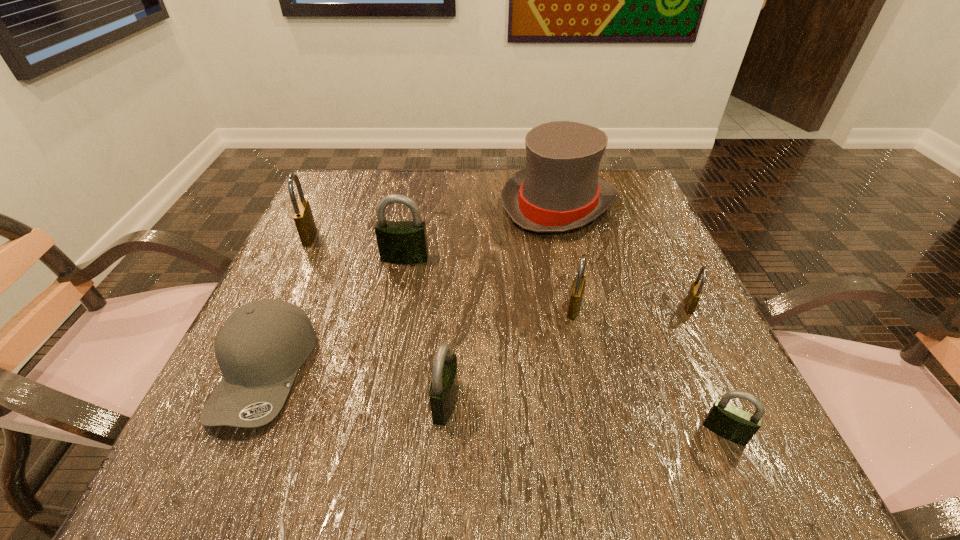
Image resolution: width=960 pixels, height=540 pixels. Identify the location of the smallest brass padlock. (695, 291).

The width and height of the screenshot is (960, 540). I want to click on the smallest black padlock, so click(732, 423).

The image size is (960, 540). What are the coordinates of `free location located on the front of the gray dress hat` in the screenshot? It's located at (593, 352).

Identify the location of vacant space located 0.240m on the front of the farthest brass padlock. This screenshot has height=540, width=960. (263, 333).

Locate an element on the screen. The width and height of the screenshot is (960, 540). free space located 0.130m on the left of the biggest black padlock is located at coordinates (318, 258).

The width and height of the screenshot is (960, 540). Identify the location of free space located 0.090m on the right of the third padlock from right to left. (633, 308).

Where is `free space located 0.340m on the back of the fourth object from left to right`? Image resolution: width=960 pixels, height=540 pixels. free space located 0.340m on the back of the fourth object from left to right is located at coordinates (456, 245).

What are the coordinates of `blank space located 0.160m on the back of the smallest brass padlock` in the screenshot? It's located at (660, 245).

This screenshot has width=960, height=540. Find the location of `vacant space located on the left of the smallest black padlock`. vacant space located on the left of the smallest black padlock is located at coordinates (670, 431).

Image resolution: width=960 pixels, height=540 pixels. What are the coordinates of `object at the far edge` in the screenshot? It's located at (559, 190).